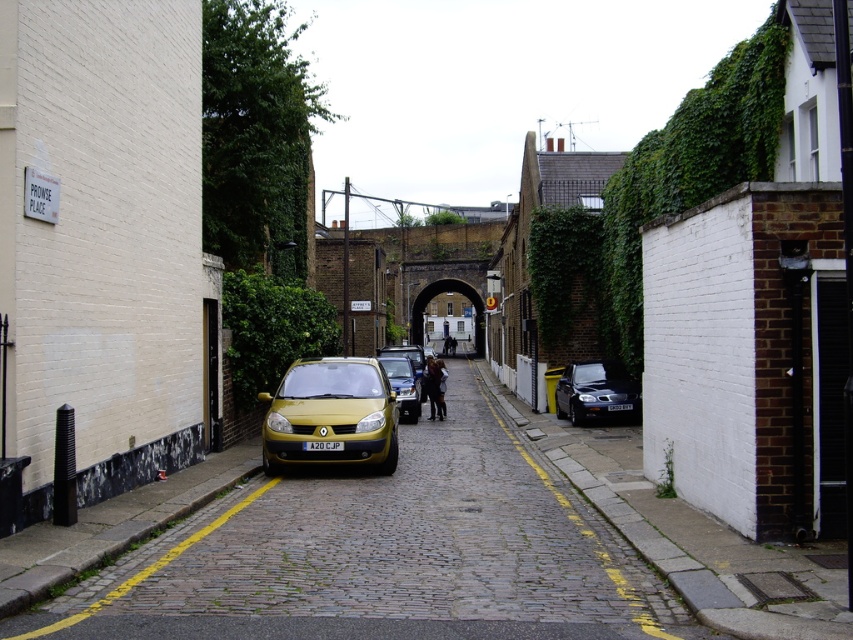
Question: Is metallic gold car at center further to camera compared to white plastic license plate at center?

Choices:
 (A) no
 (B) yes

Answer: (B)

Question: Does metallic gold car at center appear on the left side of white plastic license plate at center?

Choices:
 (A) yes
 (B) no

Answer: (B)

Question: Which object is the farthest from the shiny black car at center?

Choices:
 (A) gold matte car at center
 (B) matte yellow car at center
 (C) white plastic license plate at center

Answer: (C)

Question: Based on their relative distances, which object is farther from the black plastic license plate at center?

Choices:
 (A) shiny black car at center
 (B) dark brown leather jacket at center

Answer: (B)

Question: Which point appears farthest from the camera in this image?

Choices:
 (A) [624, 403]
 (B) [395, 378]
 (C) [426, 364]
 (D) [581, 518]

Answer: (C)

Question: Can you confirm if shiny black car at center is positioned above white plastic license plate at center?

Choices:
 (A) no
 (B) yes

Answer: (B)